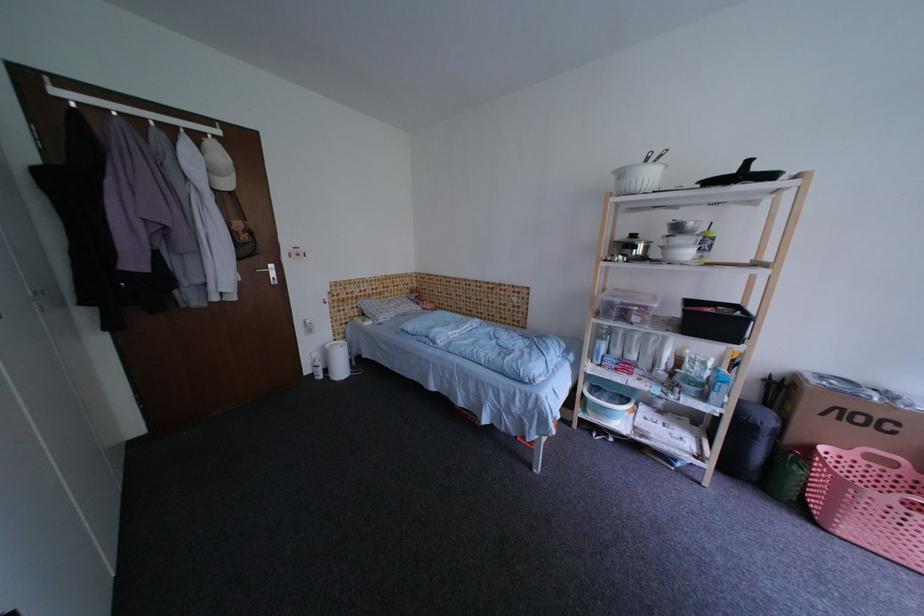
Find where to lift the white air purifier. Please return your answer as a coordinate pair (x, y).

(337, 360)